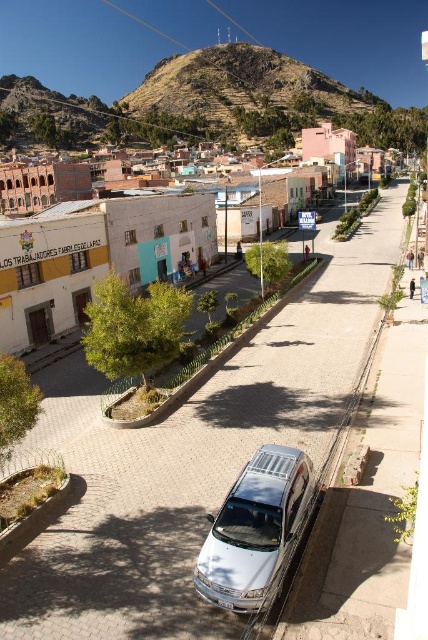
Does rugged brown hill at upper center appear under silver metallic van at center?

Incorrect, rugged brown hill at upper center is not positioned below silver metallic van at center.

At what (x,y) coordinates should I click in order to perform the action: click on rugged brown hill at upper center. Please return your answer as a coordinate pair (x, y). The image size is (428, 640). Looking at the image, I should click on (241, 90).

Identify the location of rugged brown hill at upper center. The image size is (428, 640). (241, 90).

This screenshot has height=640, width=428. In order to click on rugged brown hill at upper center in this screenshot , I will do `click(241, 90)`.

Who is more distant from viewer, (68, 236) or (249, 49)?

The point (249, 49) is behind.

What do you see at coordinates (92, 253) in the screenshot? Image resolution: width=428 pixels, height=640 pixels. I see `white concrete building at center` at bounding box center [92, 253].

The image size is (428, 640). Identify the location of white concrete building at center. (92, 253).

Describe the element at coordinates (92, 253) in the screenshot. I see `white concrete building at center` at that location.

Which is above, white concrete building at center or silver metallic van at center?

Positioned higher is white concrete building at center.

Does point (178, 225) come closer to viewer compared to point (231, 522)?

No, (178, 225) is further to viewer.

The width and height of the screenshot is (428, 640). Identify the location of white concrete building at center. (92, 253).